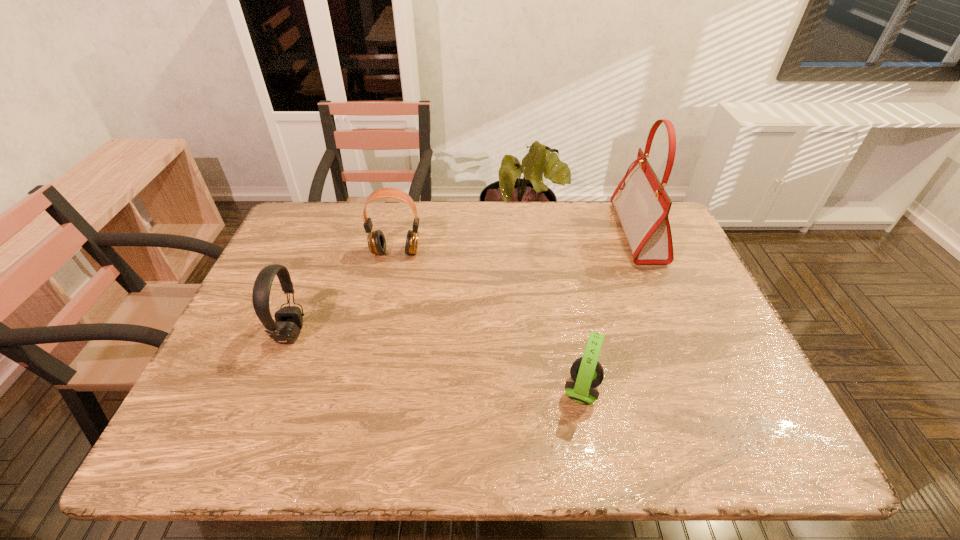
Where is `the rightmost object`? The height and width of the screenshot is (540, 960). the rightmost object is located at coordinates (642, 204).

Find the location of `handbag`. handbag is located at coordinates (642, 204).

You are a GUI agent. You are given a task and a screenshot of the screen. Output one action in this format:
    pyautogui.click(x=<x>, y=<y>)
    Task: Click on the second headset from right to left
    
    Given the screenshot: What is the action you would take?
    pyautogui.click(x=376, y=240)

Where is `the second object from left to right`? This screenshot has width=960, height=540. the second object from left to right is located at coordinates (376, 240).

Find the location of a particular element. the leftmost object is located at coordinates (288, 323).

Where is `the second farthest headset`? the second farthest headset is located at coordinates (288, 323).

Where is `the rightmost headset`? the rightmost headset is located at coordinates (587, 373).

In order to click on the nearest headset in this screenshot , I will do `click(587, 373)`.

Find the location of a particular element. Image resolution: width=960 pixels, height=540 pixels. free space located on the front of the rightmost object is located at coordinates (674, 316).

I want to click on free space located on the ear cups of the farthest headset, so click(390, 279).